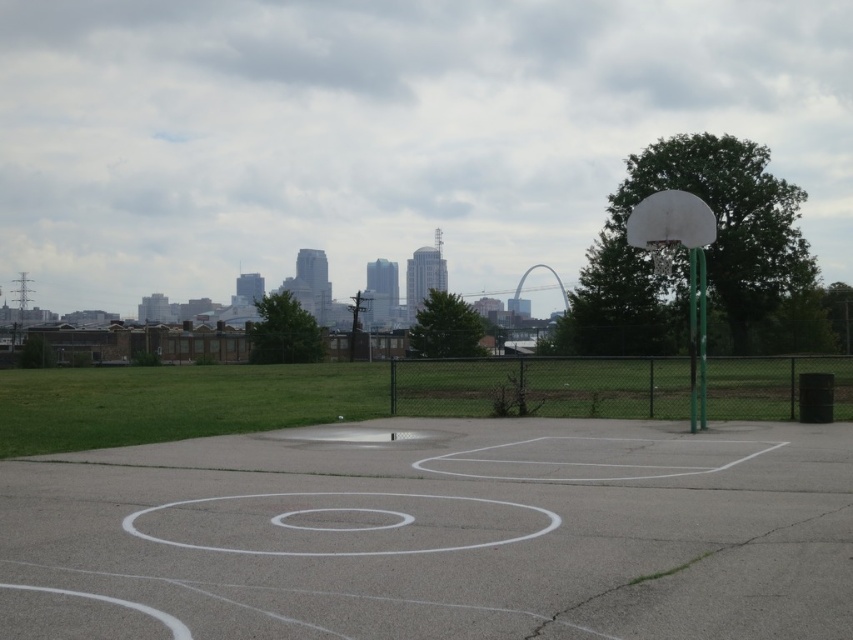
What do you see at coordinates (437, 534) in the screenshot? The height and width of the screenshot is (640, 853). I see `white concrete basketball court at center` at bounding box center [437, 534].

Who is more distant from viewer, [399,508] or [699,212]?

Point [699,212]

Between point (428, 611) and point (694, 275), which one is positioned behind?

The point (694, 275) is more distant.

Locate an element on the screen. white concrete basketball court at center is located at coordinates (437, 534).